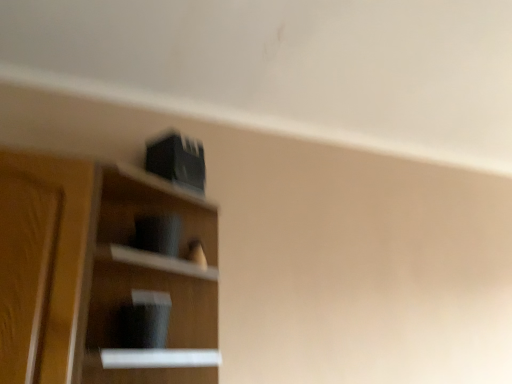
What is the approximate width of black matte speaker at upper center?

The width of black matte speaker at upper center is 10.73 inches.

Describe the element at coordinates (103, 276) in the screenshot. I see `black matte speaker at upper center` at that location.

This screenshot has width=512, height=384. Identify the location of black matte speaker at upper center. (103, 276).

Find the location of a particular element. black matte speaker at upper center is located at coordinates (103, 276).